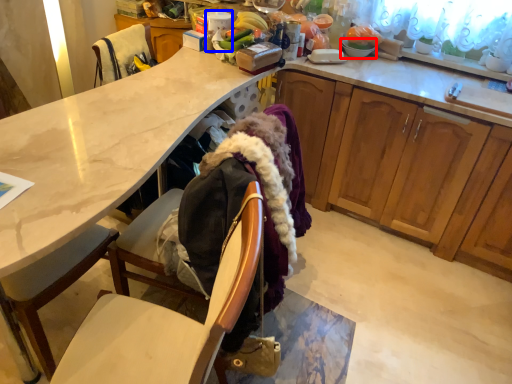
Question: Among these objects, which one is farthest to the camera, tableware (highlighted by a red box) or kitchen appliance (highlighted by a blue box)?

Choices:
 (A) tableware
 (B) kitchen appliance

Answer: (A)